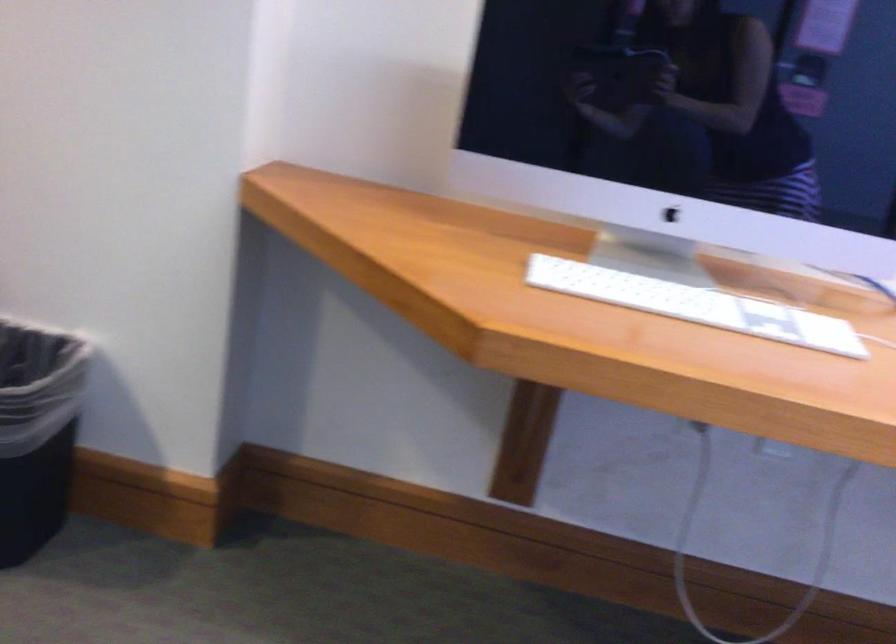
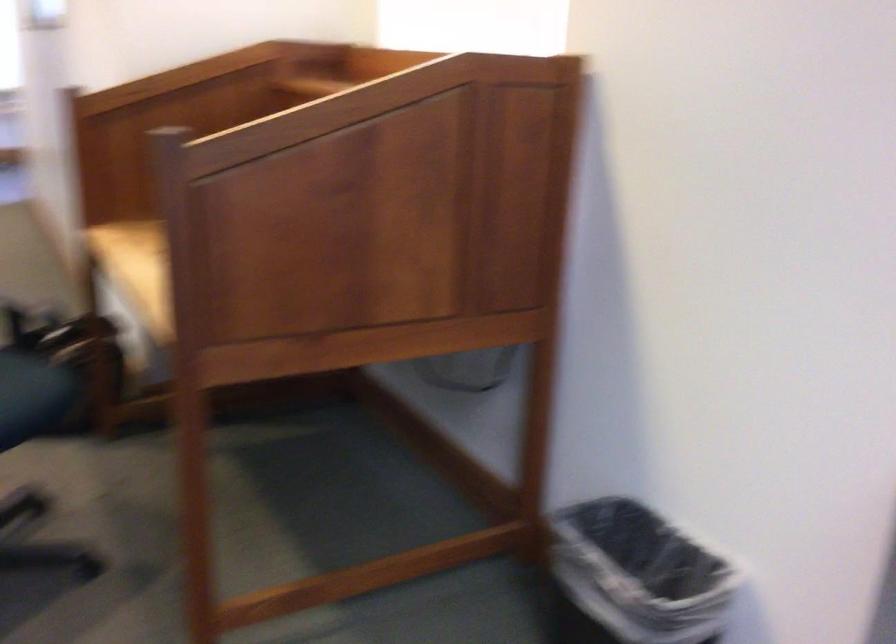
Question: The images are taken continuously from a first-person perspective. In which direction is your viewpoint rotating?

Choices:
 (A) Left
 (B) Right
 (C) Up
 (D) Down

Answer: (A)